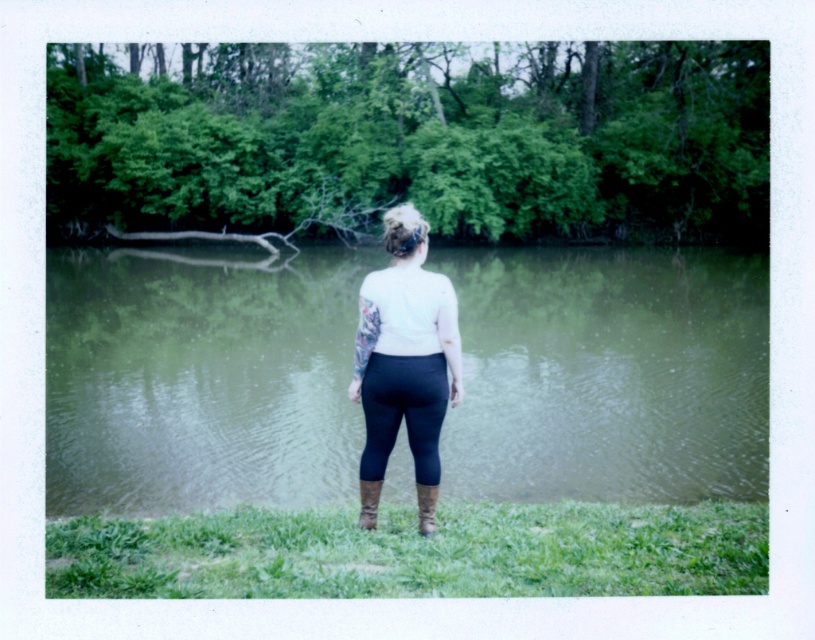
Question: Is matte white shirt at center wider than leather boot at lower center?

Choices:
 (A) no
 (B) yes

Answer: (B)

Question: Among these points, which one is farthest from the camera?

Choices:
 (A) (394, 356)
 (B) (364, 449)
 (C) (434, 529)
 (D) (86, 442)

Answer: (D)

Question: Observing the image, what is the correct spatial positioning of green reflective water at center in reference to black matte leggings at center?

Choices:
 (A) above
 (B) below

Answer: (A)

Question: Which point is closer to the camera?

Choices:
 (A) brown suede boot at lower center
 (B) black matte leggings at center
 (C) matte white shirt at center

Answer: (C)

Question: Which of the following is the closest to the observer?

Choices:
 (A) brown suede boot at lower center
 (B) green reflective water at center

Answer: (A)

Question: Can you confirm if leather boot at lower center is thinner than brown suede boot at lower center?

Choices:
 (A) yes
 (B) no

Answer: (A)